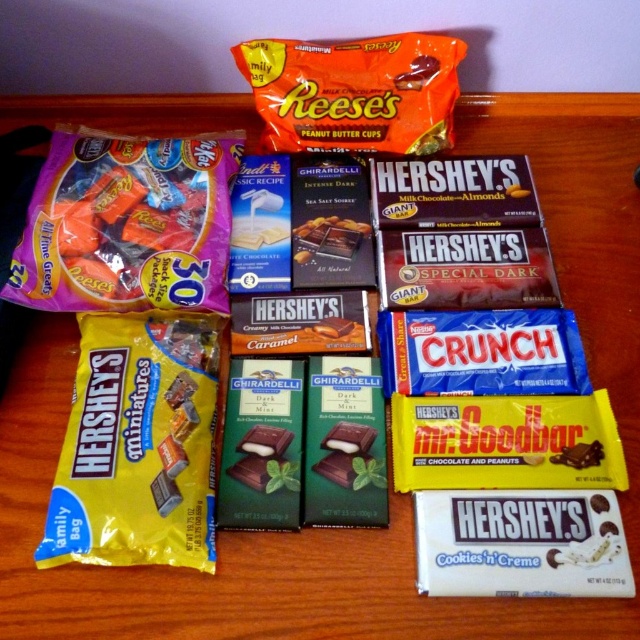
Can you confirm if yellow matte hershey's miniatures at lower left is thinner than matte plastic bag of assorted candies at upper left?

Indeed, yellow matte hershey's miniatures at lower left has a lesser width compared to matte plastic bag of assorted candies at upper left.

Between point (141, 401) and point (237, 152), which one is positioned in front?

Point (141, 401) is in front.

Locate an element on the screen. The height and width of the screenshot is (640, 640). yellow matte hershey's miniatures at lower left is located at coordinates (138, 445).

At what (x,y) coordinates should I click in order to perform the action: click on matte plastic bag of assorted candies at upper left. Please return your answer as a coordinate pair (x, y). The image size is (640, 640). Looking at the image, I should click on (128, 225).

Between matte plastic bag of assorted candies at upper left and green matte ghirardelli chocolate bar at center, which one has less height?

green matte ghirardelli chocolate bar at center is shorter.

Who is more forward, (x=198, y=209) or (x=346, y=426)?

Point (x=346, y=426) is in front.

Where is `matte plastic bag of assorted candies at upper left`? matte plastic bag of assorted candies at upper left is located at coordinates (128, 225).

Is orange matte reese's peanut butter cups at upper center below green matte ghirardelli chocolate bar at center?

Actually, orange matte reese's peanut butter cups at upper center is above green matte ghirardelli chocolate bar at center.

Does orange matte reese's peanut butter cups at upper center have a larger size compared to green matte ghirardelli chocolate bar at center?

Correct, orange matte reese's peanut butter cups at upper center is larger in size than green matte ghirardelli chocolate bar at center.

Locate an element on the screen. orange matte reese's peanut butter cups at upper center is located at coordinates (355, 92).